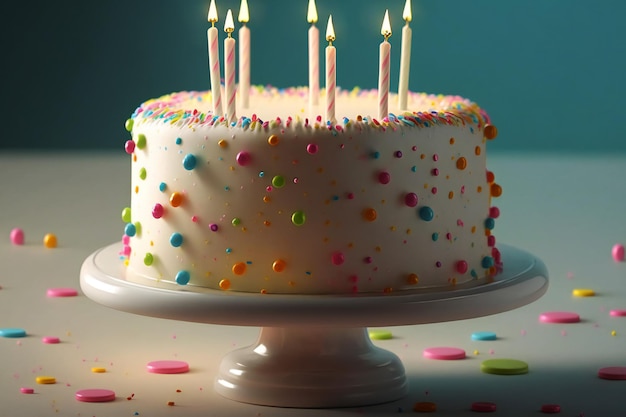
In order to click on candles in this screenshot , I will do `click(215, 83)`, `click(227, 73)`, `click(247, 59)`, `click(313, 56)`, `click(332, 70)`, `click(389, 77)`, `click(404, 64)`.